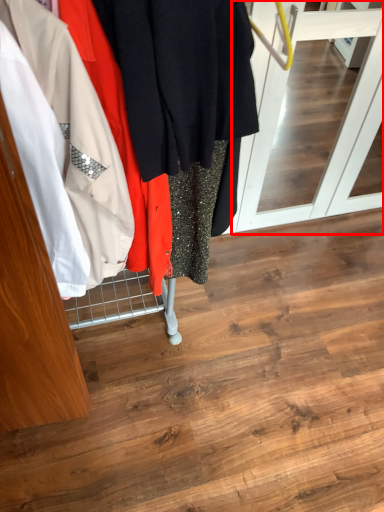
Question: From the image's perspective, what is the correct spatial relationship of screen door (annotated by the red box) in relation to closet?

Choices:
 (A) below
 (B) above

Answer: (B)